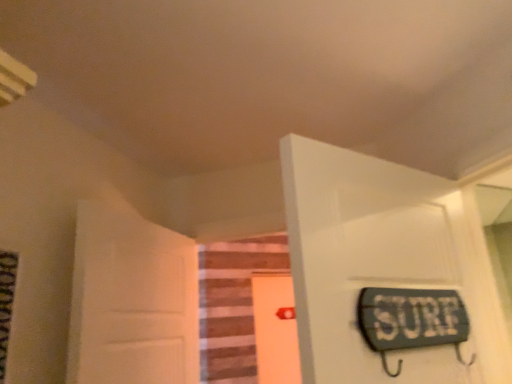
Identify the location of white glossy door at upper right, which is the 3th door from back to front. This screenshot has height=384, width=512. (362, 258).

The image size is (512, 384). In order to click on wooden stairs at center in this screenshot , I will do `click(233, 304)`.

In the scene shown: Measure the distance between orange matte door at center, the 3th door viewed from the front, and camera.

orange matte door at center, the 3th door viewed from the front, is 11.08 feet from camera.

What do you see at coordinates (132, 301) in the screenshot?
I see `white matte door at left, arranged as the 1th door when viewed from the left` at bounding box center [132, 301].

Find the location of a particular element. white matte door at left, arranged as the 1th door when viewed from the left is located at coordinates (132, 301).

Where is `white glossy door at upper right, the 3th door in the left-to-right sequence`? This screenshot has width=512, height=384. white glossy door at upper right, the 3th door in the left-to-right sequence is located at coordinates (362, 258).

Does orange matte door at center, arranged as the 2th door when viewed from the left, touch wooden stairs at center?

No, orange matte door at center, arranged as the 2th door when viewed from the left, is not touching wooden stairs at center.

Would you say orange matte door at center, acting as the first door starting from the back, contains wooden stairs at center?

No, wooden stairs at center is not surrounded by orange matte door at center, acting as the first door starting from the back.

Between orange matte door at center, acting as the first door starting from the back, and wooden stairs at center, which one has smaller size?

With smaller size is orange matte door at center, acting as the first door starting from the back.

Which of these two, orange matte door at center, the 3th door viewed from the front, or wooden stairs at center, stands shorter?

Standing shorter between the two is wooden stairs at center.

Is point (298, 221) farther from camera compared to point (214, 257)?

No, (298, 221) is in front of (214, 257).

Looking at this image, would you consider white glossy door at upper right, the first door positioned from the right, to be distant from wooden stairs at center?

Indeed, white glossy door at upper right, the first door positioned from the right, is not near wooden stairs at center.

How distant is white glossy door at upper right, the first door positioned from the right, from wooden stairs at center?

white glossy door at upper right, the first door positioned from the right, and wooden stairs at center are 7.30 feet apart from each other.

From the image's perspective, would you say white glossy door at upper right, which is the 3th door from back to front, is positioned over wooden stairs at center?

Yes, from the image's perspective, white glossy door at upper right, which is the 3th door from back to front, is over wooden stairs at center.

Is wooden stairs at center at the back of white matte door at left, which is the third door from right to left?

white matte door at left, which is the third door from right to left, is not turned away from wooden stairs at center.

Considering the relative positions of white matte door at left, the second door viewed from the back, and wooden stairs at center in the image provided, is white matte door at left, the second door viewed from the back, to the left of wooden stairs at center from the viewer's perspective?

Yes, white matte door at left, the second door viewed from the back, is to the left of wooden stairs at center.

Is white matte door at left, which is the third door from right to left, in front of or behind wooden stairs at center in the image?

white matte door at left, which is the third door from right to left, is in front of wooden stairs at center.

At what (x,y) coordinates should I click in order to perform the action: click on stairwell on the right of white matte door at left, which is the third door from right to left. Please return your answer as a coordinate pair (x, y). Image resolution: width=512 pixels, height=384 pixels. Looking at the image, I should click on (233, 304).

Which point is more forward, (389, 328) or (256, 289)?

The point (389, 328) is closer.

From the image's perspective, which is above, white glossy door at upper right, which is counted as the 1th door, starting from the front, or orange matte door at center, acting as the first door starting from the back?

From the image's view, white glossy door at upper right, which is counted as the 1th door, starting from the front, is above.

Is white glossy door at upper right, which is counted as the 1th door, starting from the front, aimed at orange matte door at center, acting as the first door starting from the back?

No, white glossy door at upper right, which is counted as the 1th door, starting from the front, is not facing towards orange matte door at center, acting as the first door starting from the back.

Who is smaller, wooden stairs at center or white matte door at left, arranged as the 1th door when viewed from the left?

wooden stairs at center is smaller.

Is wooden stairs at center situated inside white matte door at left, arranged as the 1th door when viewed from the left, or outside?

wooden stairs at center is spatially situated outside white matte door at left, arranged as the 1th door when viewed from the left.

Are wooden stairs at center and white matte door at left, arranged as the 1th door when viewed from the left, far apart?

Absolutely, wooden stairs at center is distant from white matte door at left, arranged as the 1th door when viewed from the left.

Is wooden stairs at center taller or shorter than white matte door at left, arranged as the 1th door when viewed from the left?

Considering their sizes, wooden stairs at center has more height than white matte door at left, arranged as the 1th door when viewed from the left.

Considering the sizes of orange matte door at center, placed as the second door when sorted from right to left, and white glossy door at upper right, which is the 3th door from back to front, in the image, is orange matte door at center, placed as the second door when sorted from right to left, bigger or smaller than white glossy door at upper right, which is the 3th door from back to front,?

Considering their sizes, orange matte door at center, placed as the second door when sorted from right to left, takes up less space than white glossy door at upper right, which is the 3th door from back to front.

Between orange matte door at center, the 3th door viewed from the front, and white glossy door at upper right, which is the 3th door from back to front, which one is positioned behind?

orange matte door at center, the 3th door viewed from the front.

Which of these two, orange matte door at center, acting as the first door starting from the back, or white glossy door at upper right, which is counted as the 1th door, starting from the front, stands taller?

Standing taller between the two is orange matte door at center, acting as the first door starting from the back.

Starting from the white glossy door at upper right, the first door positioned from the right, which door is the 1st one to the left? Please provide its 2D coordinates.

[(275, 329)]

Considering the relative sizes of white matte door at left, the 2th door viewed from the front, and white glossy door at upper right, which is counted as the 1th door, starting from the front, in the image provided, is white matte door at left, the 2th door viewed from the front, smaller than white glossy door at upper right, which is counted as the 1th door, starting from the front,?

No.

Is white matte door at left, the second door viewed from the back, facing away from white glossy door at upper right, which is counted as the 1th door, starting from the front?

white matte door at left, the second door viewed from the back, does not have its back to white glossy door at upper right, which is counted as the 1th door, starting from the front.

Does white matte door at left, the second door viewed from the back, have a greater height compared to white glossy door at upper right, which is the 3th door from back to front?

Correct, white matte door at left, the second door viewed from the back, is much taller as white glossy door at upper right, which is the 3th door from back to front.

Find the location of a particular element. The width and height of the screenshot is (512, 384). stairwell located above the orange matte door at center, acting as the first door starting from the back (from a real-world perspective) is located at coordinates (233, 304).

Where is `the 2nd door positioned above the wooden stairs at center (from the image's perspective)`? This screenshot has width=512, height=384. the 2nd door positioned above the wooden stairs at center (from the image's perspective) is located at coordinates tap(362, 258).

Considering their positions, is orange matte door at center, placed as the second door when sorted from right to left, positioned closer to white matte door at left, the 2th door viewed from the front, than white glossy door at upper right, which is counted as the 1th door, starting from the front?

white glossy door at upper right, which is counted as the 1th door, starting from the front, is closer to white matte door at left, the 2th door viewed from the front.

Based on their spatial positions, is wooden stairs at center or white glossy door at upper right, which is the 3th door from back to front, closer to orange matte door at center, acting as the first door starting from the back?

wooden stairs at center is closer to orange matte door at center, acting as the first door starting from the back.

When comparing their distances from wooden stairs at center, does orange matte door at center, placed as the second door when sorted from right to left, or white glossy door at upper right, the 3th door in the left-to-right sequence, seem closer?

Based on the image, orange matte door at center, placed as the second door when sorted from right to left, appears to be nearer to wooden stairs at center.

From the picture: Based on their spatial positions, is white glossy door at upper right, the first door positioned from the right, or wooden stairs at center further from orange matte door at center, acting as the first door starting from the back?

Among the two, white glossy door at upper right, the first door positioned from the right, is located further to orange matte door at center, acting as the first door starting from the back.

Which object lies further to the anchor point wooden stairs at center, white matte door at left, the 2th door viewed from the front, or orange matte door at center, acting as the first door starting from the back?

The object further to wooden stairs at center is white matte door at left, the 2th door viewed from the front.

Based on their spatial positions, is white glossy door at upper right, which is counted as the 1th door, starting from the front, or orange matte door at center, arranged as the 2th door when viewed from the left, closer to wooden stairs at center?

Based on the image, orange matte door at center, arranged as the 2th door when viewed from the left, appears to be nearer to wooden stairs at center.

Estimate the real-world distances between objects in this image. Which object is further from white glossy door at upper right, which is counted as the 1th door, starting from the front, white matte door at left, the second door viewed from the back, or orange matte door at center, arranged as the 2th door when viewed from the left?

Among the two, orange matte door at center, arranged as the 2th door when viewed from the left, is located further to white glossy door at upper right, which is counted as the 1th door, starting from the front.

Looking at the image, which one is located further to orange matte door at center, placed as the second door when sorted from right to left, wooden stairs at center or white matte door at left, the second door viewed from the back?

white matte door at left, the second door viewed from the back, lies further to orange matte door at center, placed as the second door when sorted from right to left, than the other object.

Find the location of a particular element. The width and height of the screenshot is (512, 384). stairwell between white glossy door at upper right, which is the 3th door from back to front, and orange matte door at center, the 3th door viewed from the front, from front to back is located at coordinates pos(233,304).

The image size is (512, 384). What are the coordinates of `door positioned between white glossy door at upper right, the 3th door in the left-to-right sequence, and orange matte door at center, the 3th door viewed from the front, from near to far` in the screenshot? It's located at (132, 301).

Find the location of `stairwell between white matte door at left, the 2th door viewed from the front, and orange matte door at center, the 3th door viewed from the front, from front to back`. stairwell between white matte door at left, the 2th door viewed from the front, and orange matte door at center, the 3th door viewed from the front, from front to back is located at coordinates (233, 304).

Identify the location of door located between white glossy door at upper right, which is the 3th door from back to front, and wooden stairs at center in the depth direction. Image resolution: width=512 pixels, height=384 pixels. (132, 301).